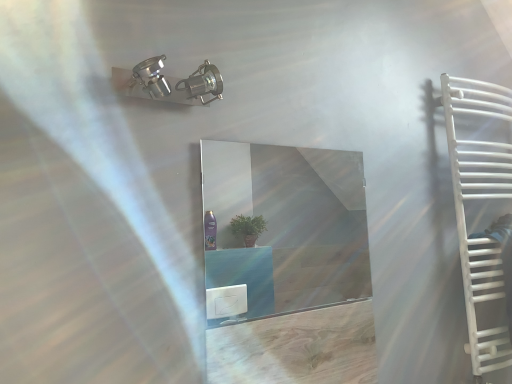
Describe the element at coordinates (287, 224) in the screenshot. I see `clear glass mirror at center` at that location.

In order to face clear glass mirror at center, should I rotate leftwards or rightwards?

Turn right approximately 4.646 degrees to face it.

Locate an element on the screen. This screenshot has height=384, width=512. white matte towel rack at right is located at coordinates (482, 211).

Is white matte towel rack at right situated inside clear glass mirror at center or outside?

white matte towel rack at right lies outside clear glass mirror at center.

Where is `mirror positioned vertically above the white matte towel rack at right (from a real-world perspective)`? mirror positioned vertically above the white matte towel rack at right (from a real-world perspective) is located at coordinates (287, 224).

From a real-world perspective, does white matte towel rack at right stand above clear glass mirror at center?

No, from a real-world perspective, white matte towel rack at right is not over clear glass mirror at center

Is white matte towel rack at right bigger than clear glass mirror at center?

Yes, white matte towel rack at right is bigger than clear glass mirror at center.

Considering the positions of objects clear glass mirror at center and white plastic stairs at right in the image provided, who is behind, clear glass mirror at center or white plastic stairs at right?

Positioned behind is white plastic stairs at right.

From a real-world perspective, is clear glass mirror at center above or below white plastic stairs at right?

From a real-world perspective, clear glass mirror at center is physically above white plastic stairs at right.

Where is `mirror above the white plastic stairs at right (from a real-world perspective)`? mirror above the white plastic stairs at right (from a real-world perspective) is located at coordinates (287, 224).

Is white plastic stairs at right thinner than white matte towel rack at right?

Yes.

Considering the positions of points (496, 249) and (453, 105), is point (496, 249) farther from camera compared to point (453, 105)?

That is True.

From a real-world perspective, is white plastic stairs at right positioned above or below white matte towel rack at right?

From a real-world perspective, white plastic stairs at right is physically below white matte towel rack at right.

From the image's perspective, is clear glass mirror at center located beneath white matte towel rack at right?

No.

You are a GUI agent. You are given a task and a screenshot of the screen. Output one action in this format:
    pyautogui.click(x=<x>, y=<y>)
    Task: Click on the mirror lying in front of the white matte towel rack at right
    
    Given the screenshot: What is the action you would take?
    pyautogui.click(x=287, y=224)

From a real-world perspective, is clear glass mirror at center physically below white matte towel rack at right?

No, from a real-world perspective, clear glass mirror at center is not beneath white matte towel rack at right.

Between clear glass mirror at center and white matte towel rack at right, which one appears on the right side from the viewer's perspective?

From the viewer's perspective, white matte towel rack at right appears more on the right side.

Based on their sizes in the image, would you say white matte towel rack at right is bigger or smaller than white plastic stairs at right?

In the image, white matte towel rack at right appears to be larger than white plastic stairs at right.

Considering the relative sizes of white matte towel rack at right and white plastic stairs at right in the image provided, is white matte towel rack at right wider than white plastic stairs at right?

Indeed, white matte towel rack at right has a greater width compared to white plastic stairs at right.

From a real-world perspective, does white matte towel rack at right sit lower than white plastic stairs at right?

Incorrect, from a real-world perspective, white matte towel rack at right is higher than white plastic stairs at right.

Which is in front, white matte towel rack at right or white plastic stairs at right?

white matte towel rack at right is more forward.

Does point (486, 301) come farther from viewer compared to point (278, 285)?

No, (486, 301) is closer to viewer.

Can you confirm if white plastic stairs at right is positioned to the left of clear glass mirror at center?

No.

Can you confirm if white plastic stairs at right is shorter than clear glass mirror at center?

Indeed, white plastic stairs at right has a lesser height compared to clear glass mirror at center.

From the image's perspective, which object appears higher, white plastic stairs at right or clear glass mirror at center?

clear glass mirror at center appears higher in the image.

This screenshot has width=512, height=384. I want to click on ladder behind the clear glass mirror at center, so click(x=482, y=211).

Where is `stairs below the clear glass mirror at center (from the image's perspective)`? This screenshot has width=512, height=384. stairs below the clear glass mirror at center (from the image's perspective) is located at coordinates [485, 304].

From the image, which object appears to be farther from white matte towel rack at right, white plastic stairs at right or clear glass mirror at center?

clear glass mirror at center is further to white matte towel rack at right.

Which object lies nearer to the anchor point clear glass mirror at center, white matte towel rack at right or white plastic stairs at right?

The object closer to clear glass mirror at center is white matte towel rack at right.

Estimate the real-world distances between objects in this image. Which object is closer to clear glass mirror at center, white plastic stairs at right or white matte towel rack at right?

white matte towel rack at right is closer to clear glass mirror at center.

Based on their spatial positions, is clear glass mirror at center or white matte towel rack at right closer to white plastic stairs at right?

Based on the image, white matte towel rack at right appears to be nearer to white plastic stairs at right.

Looking at this image, considering their positions, is white matte towel rack at right positioned further to white plastic stairs at right than clear glass mirror at center?

clear glass mirror at center.

Which object lies nearer to the anchor point white matte towel rack at right, clear glass mirror at center or white plastic stairs at right?

The object closer to white matte towel rack at right is white plastic stairs at right.

Where is `stairs located between clear glass mirror at center and white matte towel rack at right in the left-right direction`? stairs located between clear glass mirror at center and white matte towel rack at right in the left-right direction is located at coordinates (485, 304).